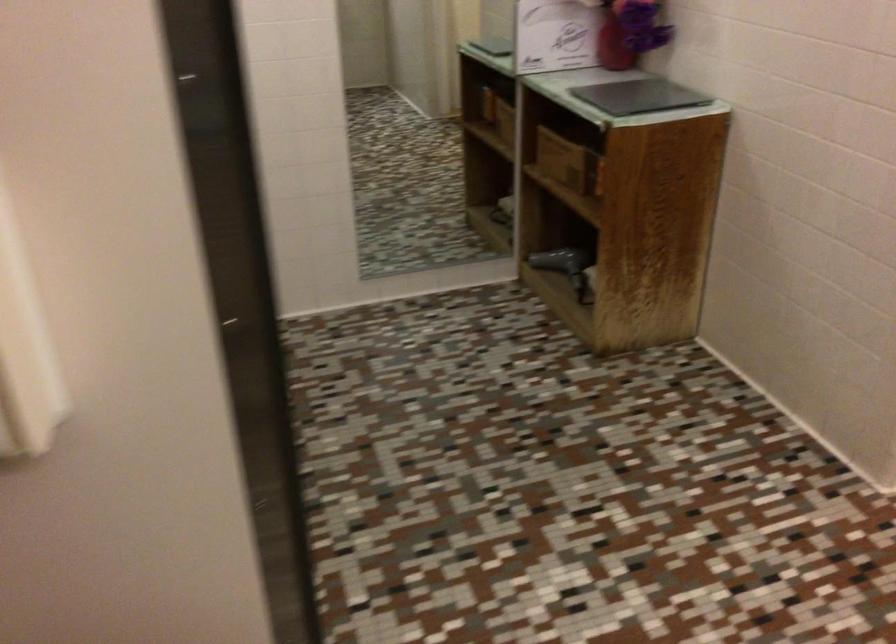
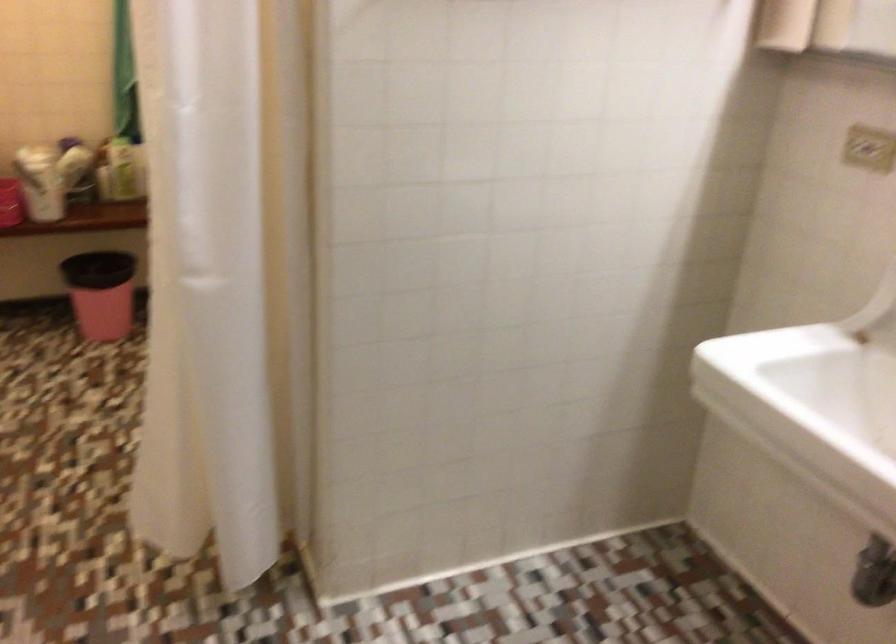
Based on the continuous images, in which direction is the camera rotating?

The camera rotated toward right-down.